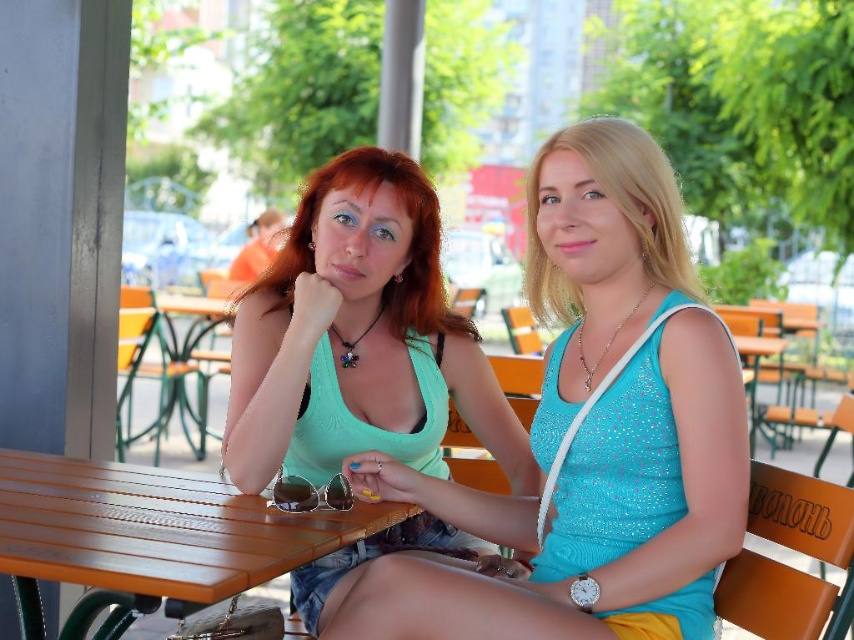
You are a photographer trying to capture a candid shot of the two women at the outdoor cafe. You notice the green matte tank top at center and the wooden at center. Which object is positioned to the right of the other?

The green matte tank top at center is to the right of wooden at center.

You are a photographer trying to capture a closeup of the woman on the left. You notice two points in the scene marked as point 1 at coordinates point (571, 600) and point 2 at coordinates point (196, 579). Which point should you focus on to ensure the woman on the left is in sharp focus?

You should focus on point 1 at coordinates point (571, 600) because it is closer to the viewer than point 2 at coordinates point (196, 579), ensuring the woman on the left is in focus.